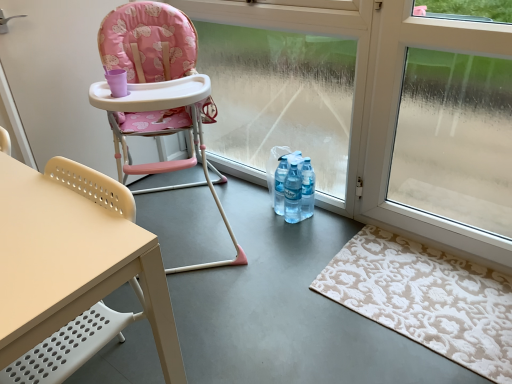
I want to click on vacant area that lies between transparent glass window at center and translucent plastic bottles at center, so click(x=264, y=198).